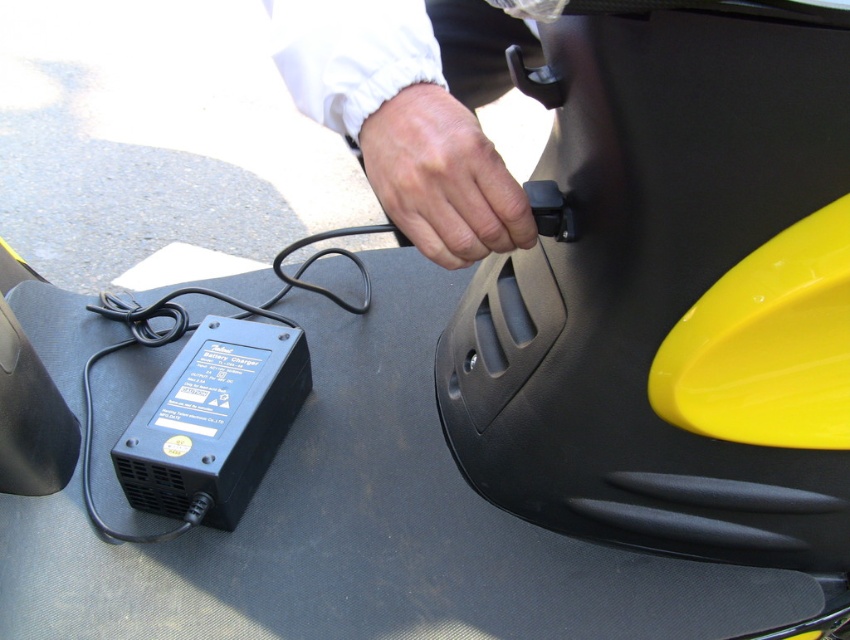
You are a technician trying to connect a cable to the charger. You see the black plastic plug at lower left and the skinny white hand at center. Which object is closer to you?

The skinny white hand at center is behind the black plastic plug at lower left, so the black plastic plug at lower left is closer to you.

You are a robot trying to grab the charger. There are two hands in the image, a white fabric hand at upper center and a skinny white hand at center. Which hand is closer to the charger?

The white fabric hand at upper center and skinny white hand at center are 0.49 inches apart from each other. Since the distance between them is very small, both hands are equally close to the charger.

You are a technician inspecting the charger on the trunk lid. Where exactly is the white fabric hand at upper center positioned in relation to the charger?

The white fabric hand at upper center is located at point coordinates (412,109) relative to the charger.